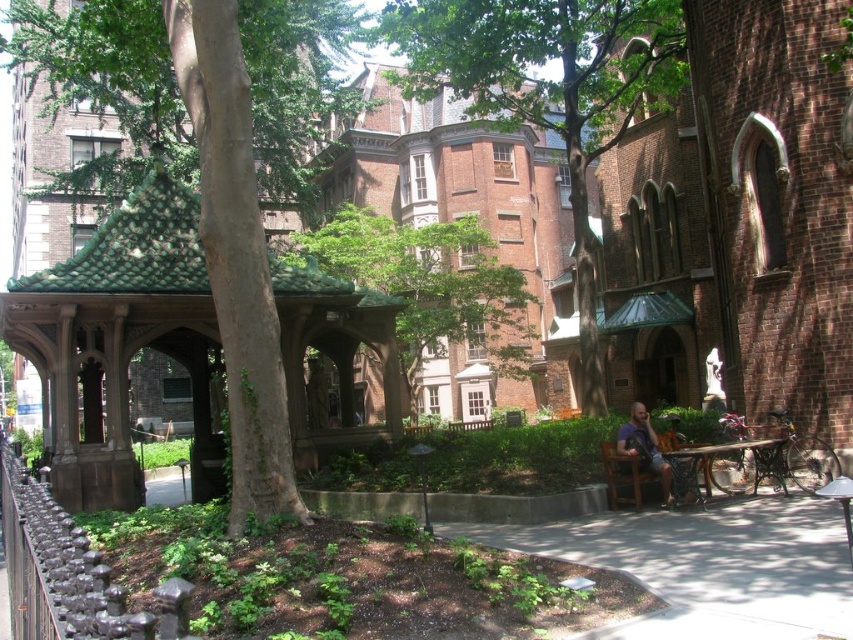
You are a visitor in the park and want to take a photo of the green textured gazebo at center without the green leafy tree at center blocking the view. Which direction should you move to achieve this?

The green textured gazebo at center is behind the green leafy tree at center, so moving to the side of the tree would allow you to position yourself where the tree no longer blocks the gazebo.

You are a visitor in the park and want to take a photo of both the green leafy tree at center and the green textured gazebo at center. Which object should you stand closer to in order to capture both in the same frame?

You should stand closer to the green textured gazebo at center because the green leafy tree at center is much taller, so moving closer to the shorter object allows both to be in frame.